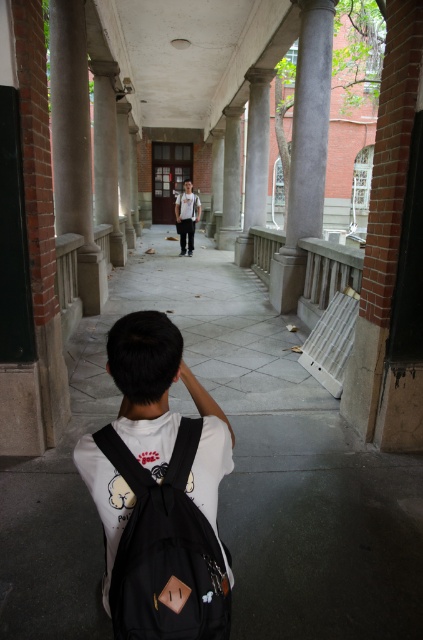
You are standing in the corridor and see two points marked on the floor. The first point is at coordinates point (200, 627) and the second is at point (324, 122). Which point is closer to you when facing the direction of the corridor?

Point (200, 627) is in front of point (324, 122), so it is closer to you when facing the direction of the corridor.

You are a student carrying a black matte backpack at lower center and want to place it on a nearby bench. The bench is 1.5 meters away from where you are standing. Can you safely place your backpack on the bench without moving closer?

The distance between you and the black matte backpack at lower center is 1.29 meters, which is less than the 1.5 meters to the bench. Therefore, you can safely place the backpack on the bench without needing to move closer.

Based on the photo, you are a student carrying a black matte backpack at lower center and want to pass through the corridor. Since the corridor has smooth gray column at center, will your backpack fit through the space between the column and the wall?

The black matte backpack at lower center is narrower than the smooth gray column at center, so it should fit through the space between the column and the wall.